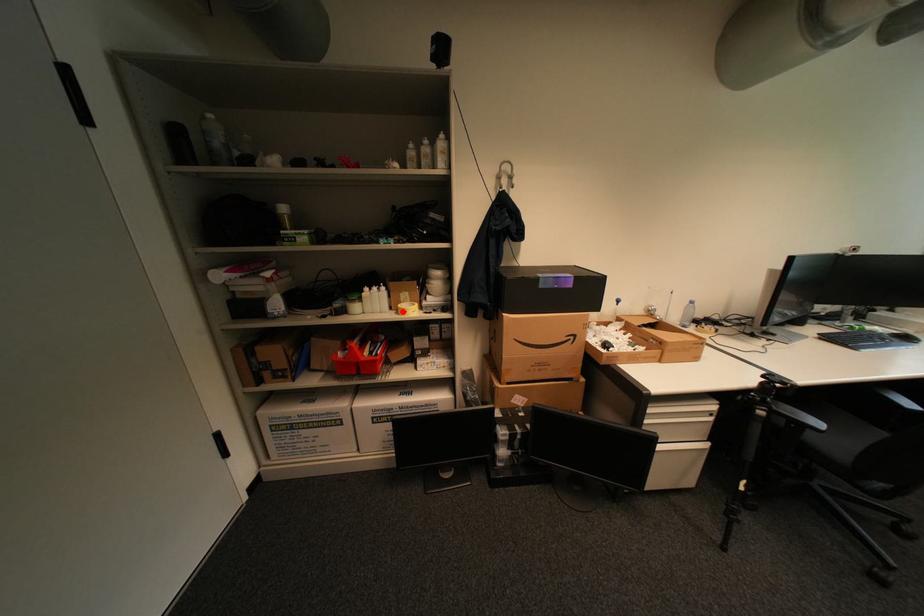
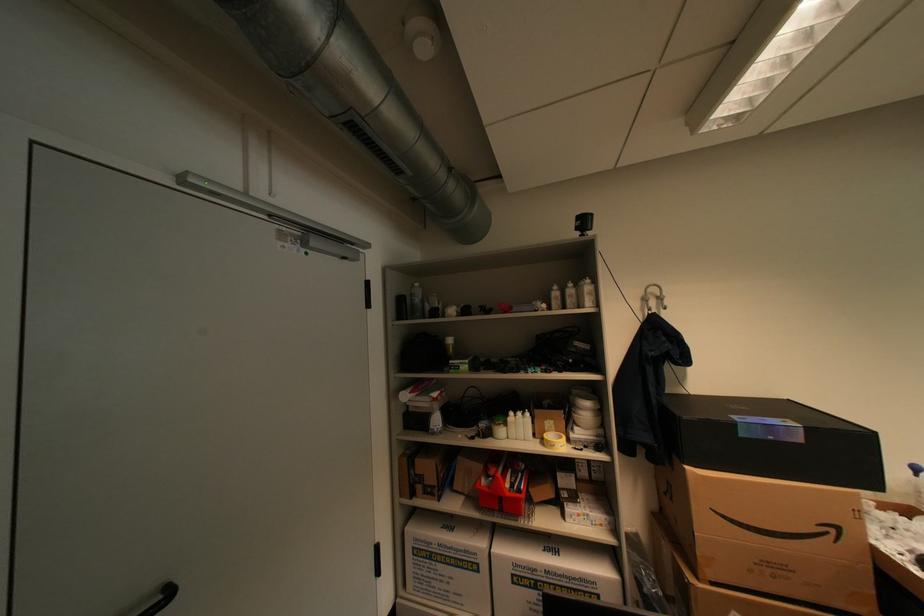
Where in the second image is the point corresponding to the highlighted location from the first image?

(546, 440)